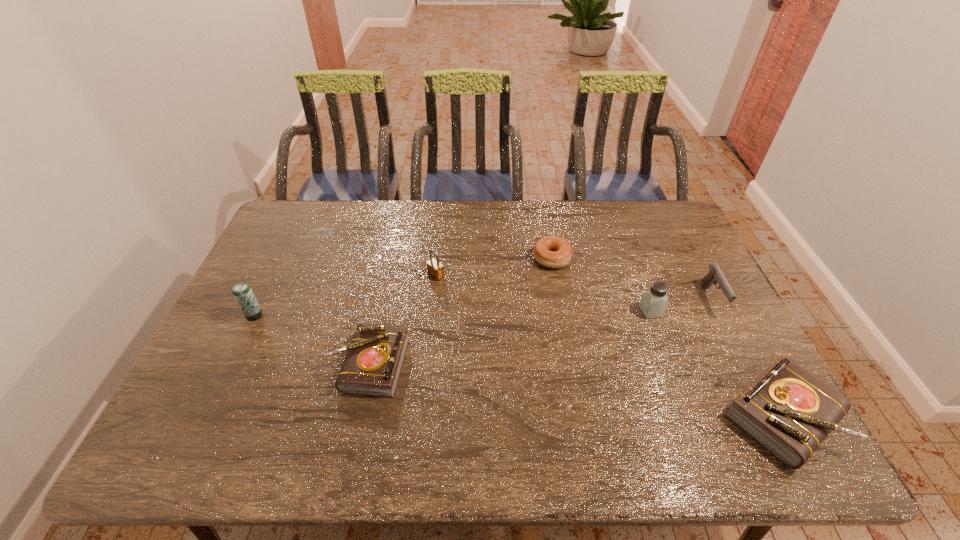
Where is `the sixth object from right to left`? the sixth object from right to left is located at coordinates (372, 366).

Where is `the shorter diary`? Image resolution: width=960 pixels, height=540 pixels. the shorter diary is located at coordinates (372, 366).

You are a GUI agent. You are given a task and a screenshot of the screen. Output one action in this format:
    pyautogui.click(x=<x>, y=<y>)
    Task: Click on the taller diary
    The image size is (960, 540).
    Given the screenshot: What is the action you would take?
    pyautogui.click(x=789, y=411)

Where is `the right diary`? The height and width of the screenshot is (540, 960). the right diary is located at coordinates (789, 411).

The image size is (960, 540). I want to click on the fourth object from right to left, so click(551, 251).

This screenshot has width=960, height=540. What are the coordinates of `bagel` in the screenshot? It's located at (551, 251).

This screenshot has width=960, height=540. Find the location of `the leftmost object`. the leftmost object is located at coordinates (242, 292).

Image resolution: width=960 pixels, height=540 pixels. Find the location of `saltshaker`. saltshaker is located at coordinates (654, 301).

Where is `the fifth object from right to left`? the fifth object from right to left is located at coordinates (435, 269).

Identify the location of pistol. (715, 275).